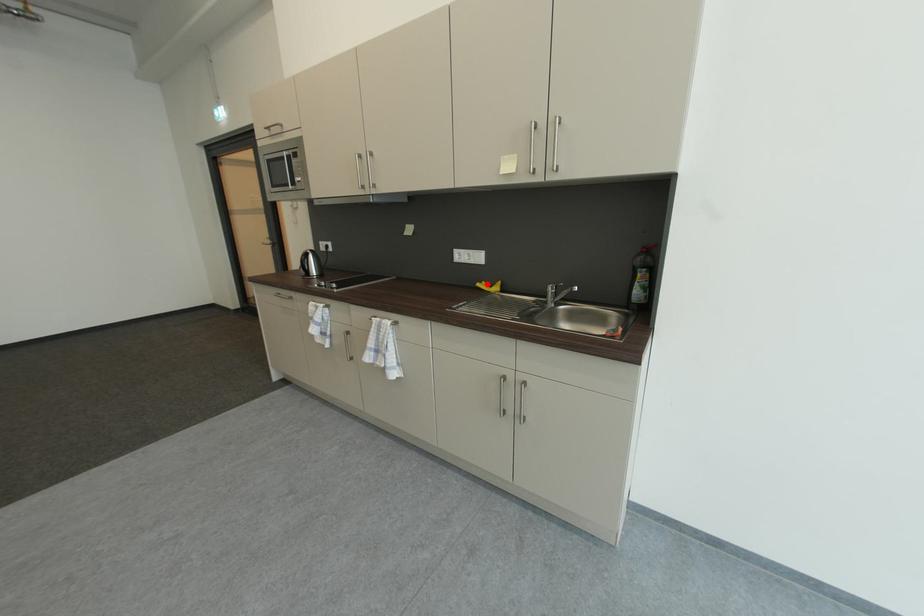
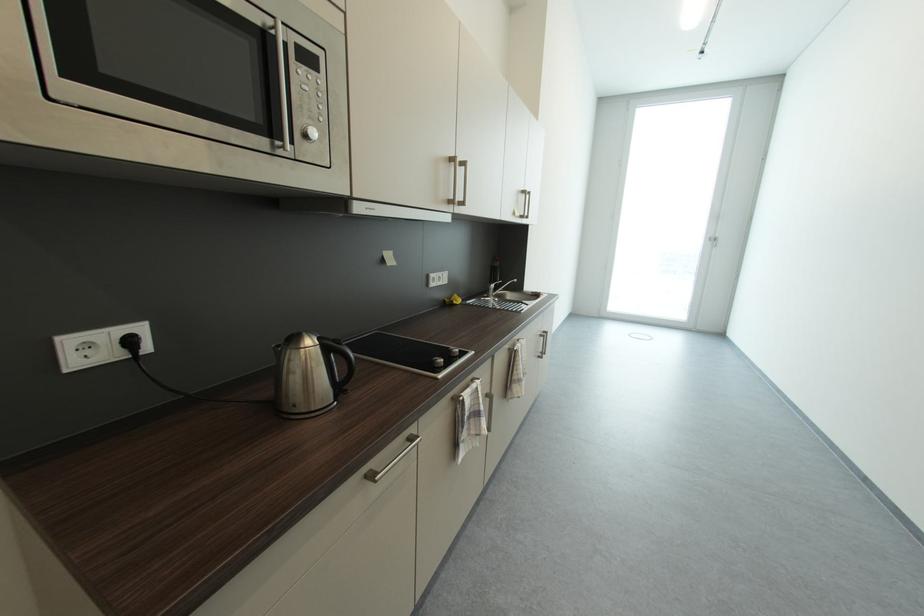
Locate, in the second image, the point that corresponds to the highlighted location in the first image.

(453, 302)